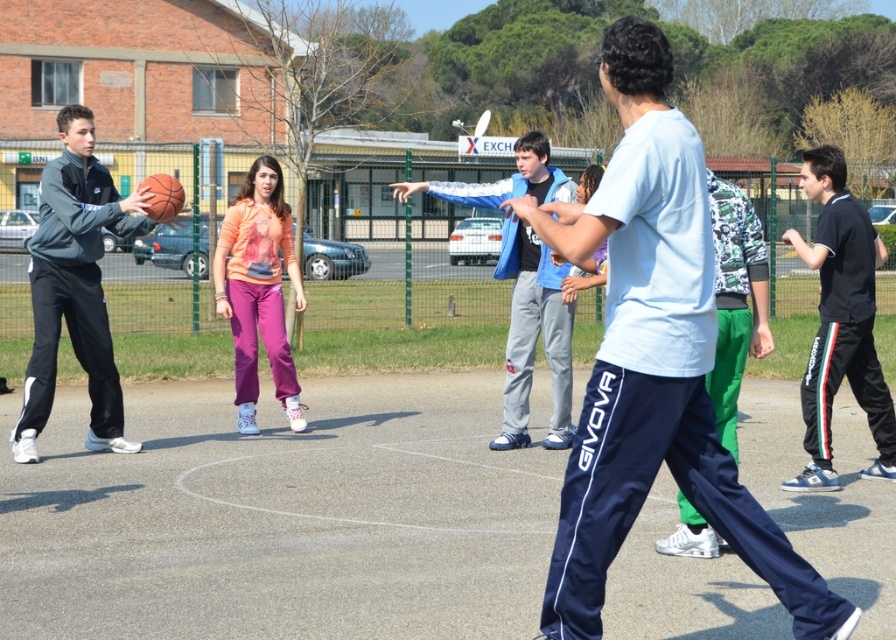
Question: Is dark gray track pants at left positioned at the back of orange soft sweatshirt at center?

Choices:
 (A) yes
 (B) no

Answer: (B)

Question: Estimate the real-world distances between objects in this image. Which object is closer to the white matte shirt at center?

Choices:
 (A) orange soft sweatshirt at center
 (B) dark gray track pants at left
 (C) rubber textured basketball at center
 (D) black smooth tracksuit at right

Answer: (D)

Question: Does black smooth tracksuit at right have a lesser width compared to rubber textured basketball at center?

Choices:
 (A) no
 (B) yes

Answer: (A)

Question: Which of the following is the farthest from the observer?

Choices:
 (A) orange soft sweatshirt at center
 (B) rubber textured basketball at center
 (C) black smooth tracksuit at right

Answer: (A)

Question: Is orange soft sweatshirt at center above rubber textured basketball at center?

Choices:
 (A) yes
 (B) no

Answer: (B)

Question: Which object is closer to the camera taking this photo?

Choices:
 (A) rubber textured basketball at center
 (B) orange soft sweatshirt at center
 (C) white matte shirt at center
 (D) black smooth tracksuit at right

Answer: (C)